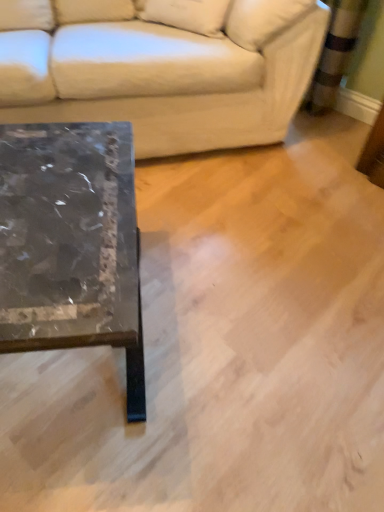
Locate an element on the screen. blank space situated above marble/black at left (from a real-world perspective) is located at coordinates (54, 203).